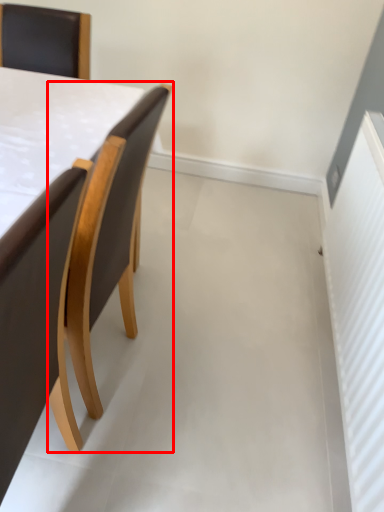
Question: Observing the image, what is the correct spatial positioning of chair (annotated by the red box) in reference to chair?

Choices:
 (A) left
 (B) right

Answer: (B)